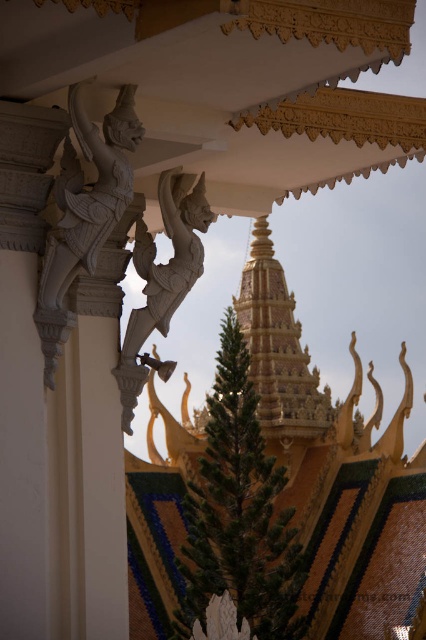
Question: Based on their relative distances, which object is farther from the white stone statue at center?

Choices:
 (A) white stone statue at upper left
 (B) gold textured spire at center

Answer: (B)

Question: Is gold textured spire at center smaller than white stone statue at center?

Choices:
 (A) no
 (B) yes

Answer: (A)

Question: Can you confirm if white stone statue at upper left is smaller than white stone statue at center?

Choices:
 (A) no
 (B) yes

Answer: (A)

Question: Estimate the real-world distances between objects in this image. Which object is farther from the gold textured spire at center?

Choices:
 (A) white stone statue at center
 (B) white stone statue at upper left

Answer: (B)

Question: Is gold textured spire at center further to the viewer compared to white stone statue at center?

Choices:
 (A) yes
 (B) no

Answer: (A)

Question: Among these points, which one is farthest from the camera?

Choices:
 (A) (175, 198)
 (B) (103, 161)
 (C) (271, 291)

Answer: (C)